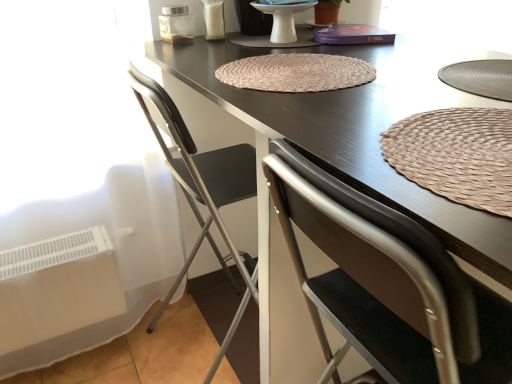
The width and height of the screenshot is (512, 384). I want to click on vacant space that's between brown woven mat at center, which appears as the 2th mat when viewed from the back, and brown woven mat at center, arranged as the first mat when viewed from the top, so click(369, 104).